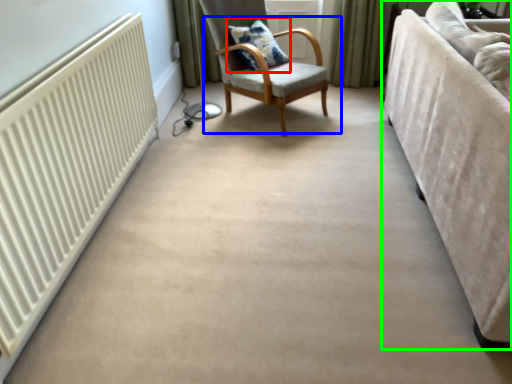
Question: Which is nearer to the pillow (highlighted by a red box)? chair (highlighted by a blue box) or studio couch (highlighted by a green box).

Choices:
 (A) chair
 (B) studio couch

Answer: (A)